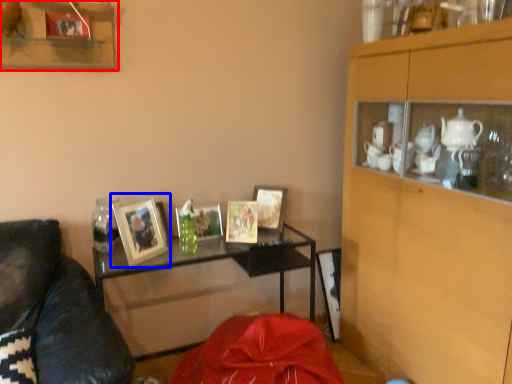
Question: Which object is further to the camera taking this photo, shelf (highlighted by a red box) or picture frame (highlighted by a blue box)?

Choices:
 (A) shelf
 (B) picture frame

Answer: (B)